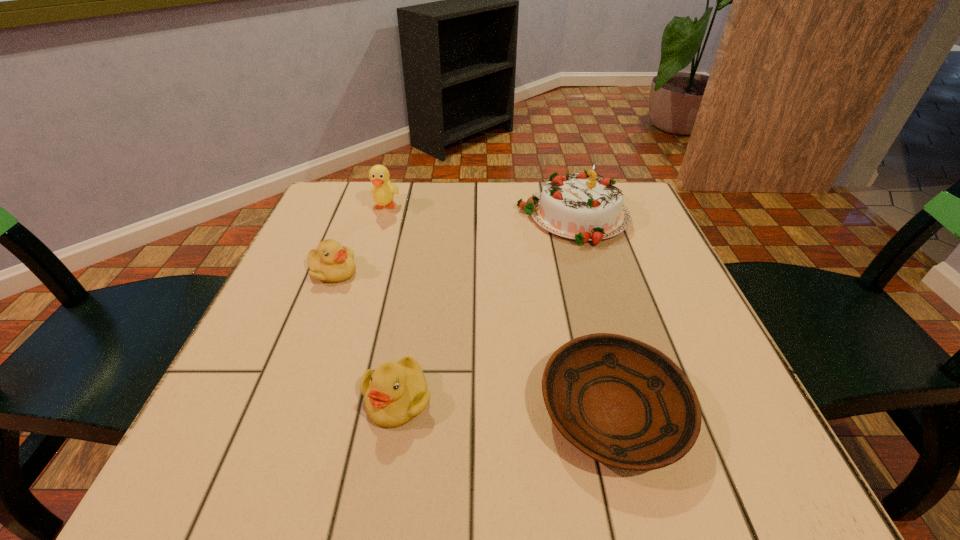
Image resolution: width=960 pixels, height=540 pixels. I want to click on free spot that satisfies the following two spatial constraints: 1. on the front-facing side of the third object from right to left; 2. on the right side of the plate, so click(x=395, y=411).

Where is `free spot that satisfies the following two spatial constraints: 1. on the back side of the plate; 2. on the front-facing side of the third farthest object`? Image resolution: width=960 pixels, height=540 pixels. free spot that satisfies the following two spatial constraints: 1. on the back side of the plate; 2. on the front-facing side of the third farthest object is located at coordinates click(578, 272).

This screenshot has height=540, width=960. In order to click on blank space that satisfies the following two spatial constraints: 1. on the front-facing side of the second nearest duckling; 2. on the left side of the plate in this screenshot , I will do `click(278, 411)`.

Where is `free region that satisfies the following two spatial constraints: 1. on the front-facing side of the plate; 2. on the right side of the tallest duckling`? This screenshot has width=960, height=540. free region that satisfies the following two spatial constraints: 1. on the front-facing side of the plate; 2. on the right side of the tallest duckling is located at coordinates (324, 411).